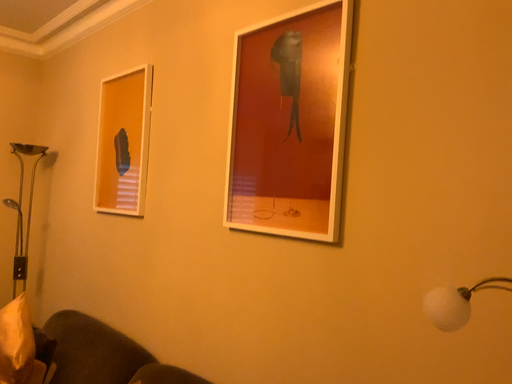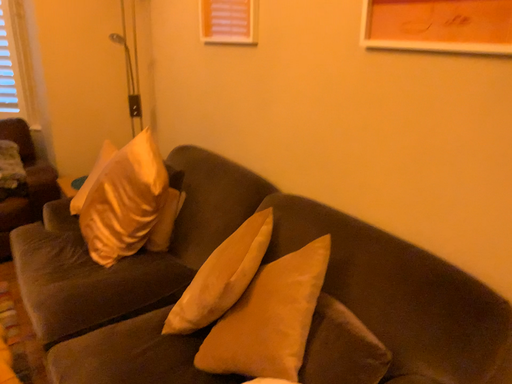
Question: Which way did the camera rotate in the video?

Choices:
 (A) rotated right
 (B) rotated left

Answer: (B)